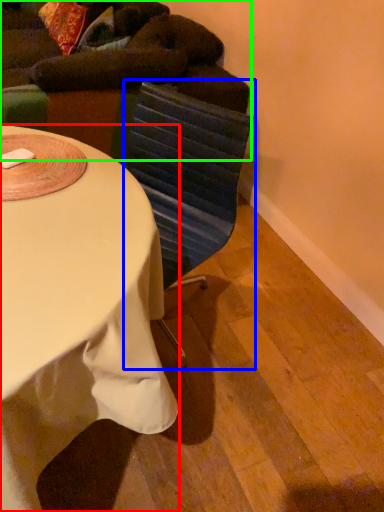
Question: Based on their relative distances, which object is farther from desk (highlighted by a red box)? Choose from swivel chair (highlighted by a blue box) and bean bag chair (highlighted by a green box).

Choices:
 (A) swivel chair
 (B) bean bag chair

Answer: (B)